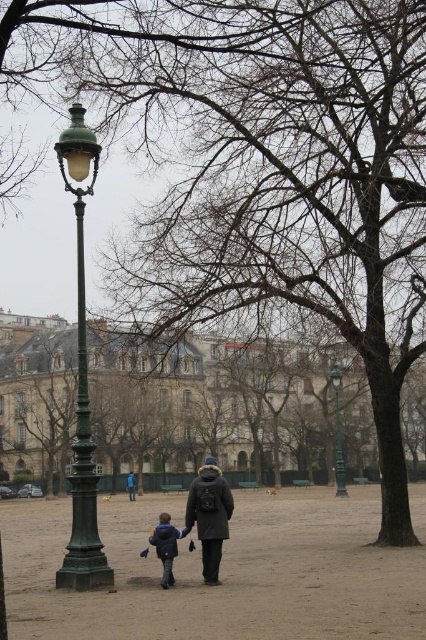
Does dark blue jacket at center have a larger size compared to green metal lamp post at center?

Actually, dark blue jacket at center might be smaller than green metal lamp post at center.

Based on the photo, can you confirm if dark blue jacket at center is thinner than green metal lamp post at center?

Yes.

Does point (155, 529) lie behind point (336, 412)?

No, (155, 529) is closer to viewer.

This screenshot has width=426, height=640. What are the coordinates of `dark blue jacket at center` in the screenshot? It's located at (166, 545).

Measure the distance between point (60, 582) and camera.

Point (60, 582) and camera are 38.87 meters apart from each other.

Is green polished metal streetlamp at left in front of dark gray wool coat at center?

Yes, green polished metal streetlamp at left is closer to the viewer.

At what (x,y) coordinates should I click in order to perform the action: click on green polished metal streetlamp at left. Please return your answer as a coordinate pair (x, y). Looking at the image, I should click on (81, 380).

The height and width of the screenshot is (640, 426). I want to click on green polished metal streetlamp at left, so click(x=81, y=380).

Between dark gray wool coat at center and blue fabric jacket at center, which one is positioned lower?

blue fabric jacket at center is lower down.

Which is in front, point (218, 476) or point (132, 499)?

Positioned in front is point (218, 476).

Find the location of `dark gray wool coat at center`. dark gray wool coat at center is located at coordinates (210, 515).